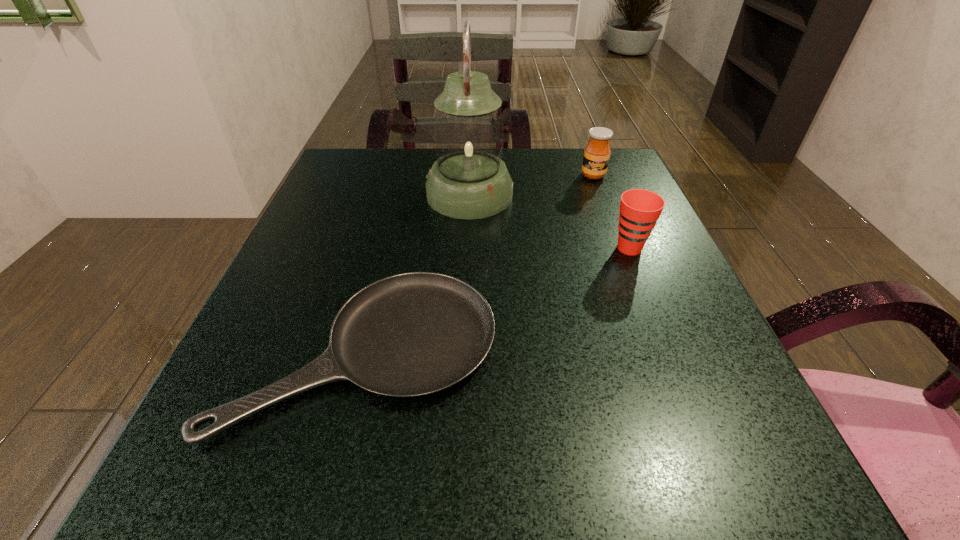
Find the location of a particular element. vacant area at the right edge of the desktop is located at coordinates (648, 349).

At what (x,y) coordinates should I click in order to perform the action: click on free region at the far left corner of the desktop. Please return your answer as a coordinate pair (x, y). This screenshot has width=960, height=540. Looking at the image, I should click on (362, 157).

Identify the location of vacant region at the far right corner of the desktop. The width and height of the screenshot is (960, 540). (608, 177).

The width and height of the screenshot is (960, 540). Identify the location of free spot between the second nearest object and the frying pan. (496, 300).

Locate an element on the screen. vacant area that lies between the honey and the cup is located at coordinates (612, 212).

Identify the location of unoccupied area between the second nearest object and the lantern. The width and height of the screenshot is (960, 540). (549, 221).

Find the location of a particular element. free point between the honey and the lantern is located at coordinates (531, 185).

Image resolution: width=960 pixels, height=540 pixels. What are the coordinates of `unoccupied area between the honey and the cup` in the screenshot? It's located at (612, 212).

Identify the location of free space that is in between the cup and the honey. Image resolution: width=960 pixels, height=540 pixels. (612, 212).

This screenshot has height=540, width=960. What are the coordinates of `vacant area that lies between the honey and the nearest object` in the screenshot? It's located at (478, 264).